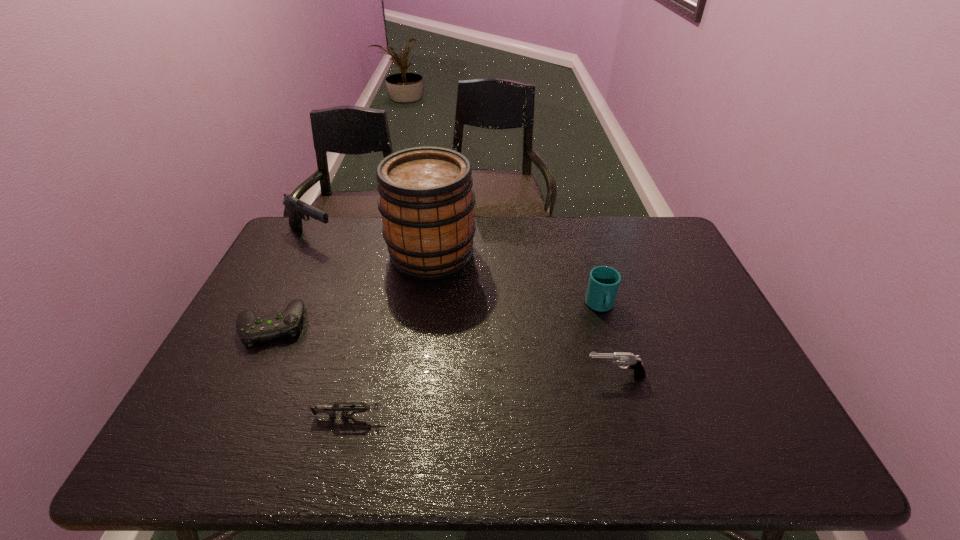
You are a GUI agent. You are given a task and a screenshot of the screen. Output one action in this format:
    pyautogui.click(x=<x>, y=<y>)
    Task: Click on the free space between the shortest gun and the control
    The image size is (960, 540).
    Given the screenshot: What is the action you would take?
    pos(312,370)

At what (x,y) coordinates should I click in order to perform the action: click on free area in between the control and the tallest gun. Please return your answer as a coordinate pair (x, y). This screenshot has width=960, height=540. Looking at the image, I should click on (292, 281).

You are a GUI agent. You are given a task and a screenshot of the screen. Output one action in this format:
    pyautogui.click(x=<x>, y=<y>)
    Task: Click on the free spot between the rightmost gun and the nearest object
    This screenshot has height=540, width=960.
    Given the screenshot: What is the action you would take?
    pyautogui.click(x=484, y=396)

What are the coordinates of `vacant area between the second nearest gun and the control` in the screenshot? It's located at (444, 350).

Image resolution: width=960 pixels, height=540 pixels. In order to click on empty location between the control and the farthest gun in this screenshot , I will do `click(292, 281)`.

Locate an element on the screen. free area in between the second gun from left to right and the tallest gun is located at coordinates (332, 327).

Locate an element on the screen. free space between the cup and the shortest gun is located at coordinates (476, 361).

Identify the location of free space between the third shortest object and the third tallest object. (608, 341).

At what (x,y) coordinates should I click in order to perform the action: click on object that is the fifth closest to the control. Please return your answer as a coordinate pair (x, y). Image resolution: width=960 pixels, height=540 pixels. Looking at the image, I should click on (603, 284).

The width and height of the screenshot is (960, 540). In order to click on object that stands as the fourth closest to the leftmost gun in this screenshot , I will do `click(603, 284)`.